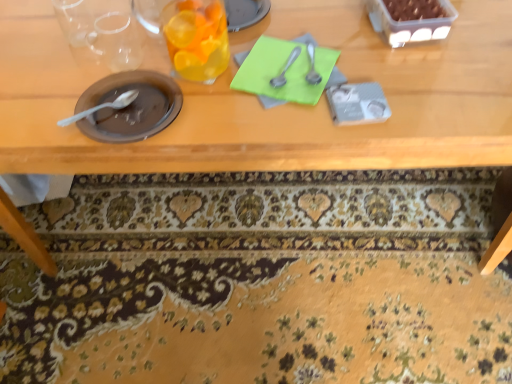
Find the location of a particular element. Image resolution: width=512 pixels, height=384 pixels. free space to the back side of green paper at center is located at coordinates (309, 20).